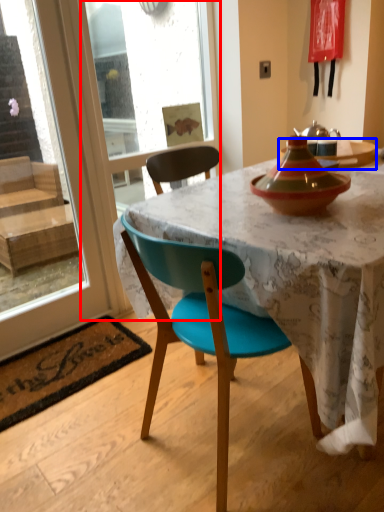
Question: Which of the following is the farthest to the observer, screen door (highlighted by a red box) or kitchen & dining room table (highlighted by a blue box)?

Choices:
 (A) screen door
 (B) kitchen & dining room table

Answer: (B)